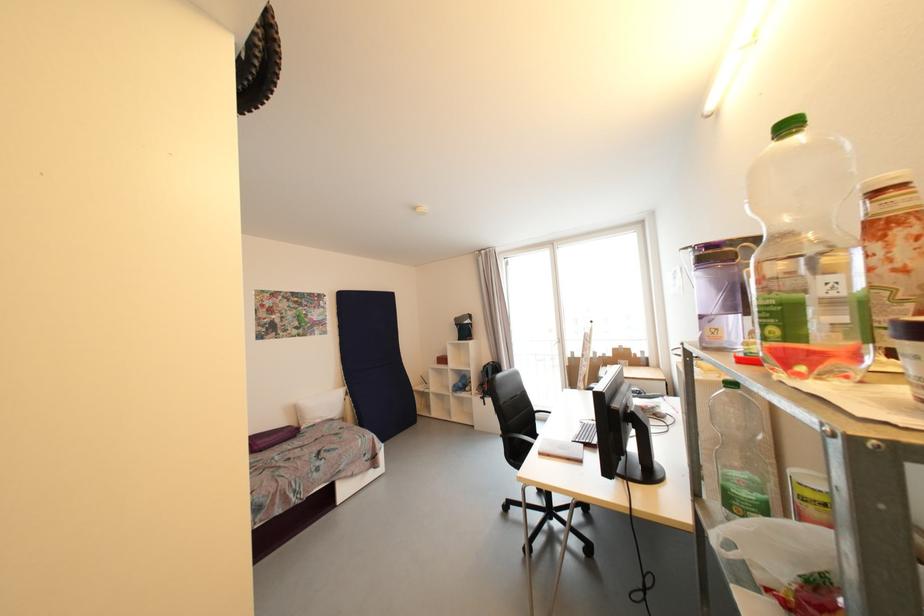
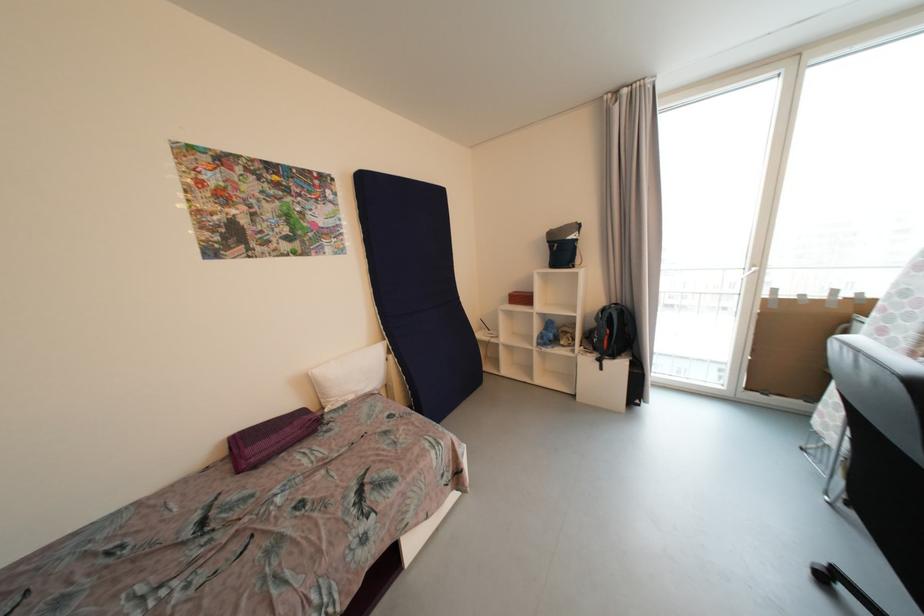
Find the pixel in the second image that matches [459,387] in the first image.

(545, 339)